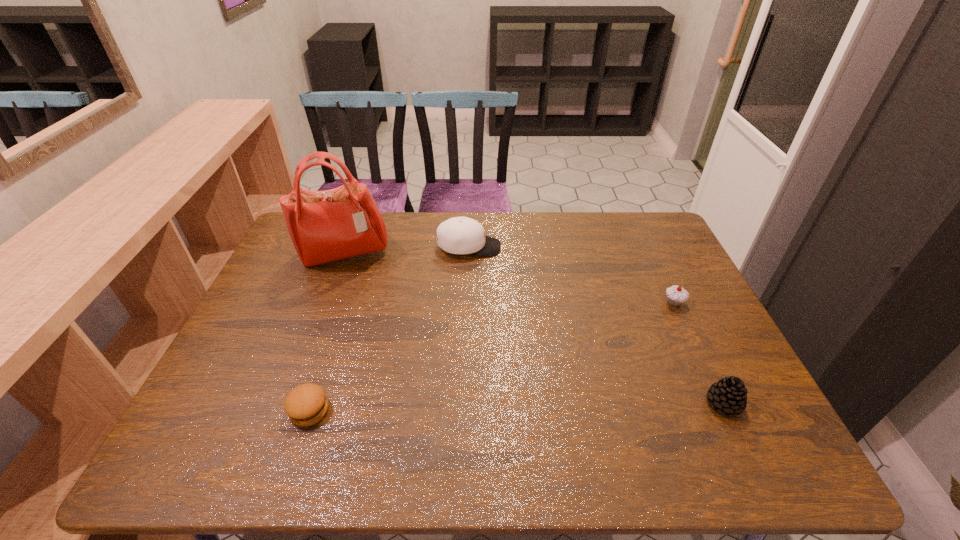
Locate an element on the screen. This screenshot has width=960, height=540. handbag situated at the far edge is located at coordinates (325, 226).

Locate an element on the screen. The height and width of the screenshot is (540, 960). baseball cap positioned at the far edge is located at coordinates (459, 235).

You are a GUI agent. You are given a task and a screenshot of the screen. Output one action in this format:
    pyautogui.click(x=<x>, y=<y>)
    Task: Click on the object present at the left edge
    Image resolution: width=960 pixels, height=540 pixels.
    Given the screenshot: What is the action you would take?
    pyautogui.click(x=325, y=226)

Identify the location of cupcake at the right edge. This screenshot has width=960, height=540. (676, 295).

This screenshot has width=960, height=540. Find the location of `pinecone that is at the right edge`. pinecone that is at the right edge is located at coordinates (729, 395).

Identify the location of object present at the far left corner. (325, 226).

Locate an element on the screen. The height and width of the screenshot is (540, 960). vacant region at the far edge of the desktop is located at coordinates (586, 228).

Where is `vacant area at the near edge`? Image resolution: width=960 pixels, height=540 pixels. vacant area at the near edge is located at coordinates tap(607, 464).

Locate an element on the screen. The width and height of the screenshot is (960, 540). vacant space at the left edge of the desktop is located at coordinates (247, 366).

Find the location of a particular element. The height and width of the screenshot is (540, 960). vacant space at the right edge is located at coordinates (704, 320).